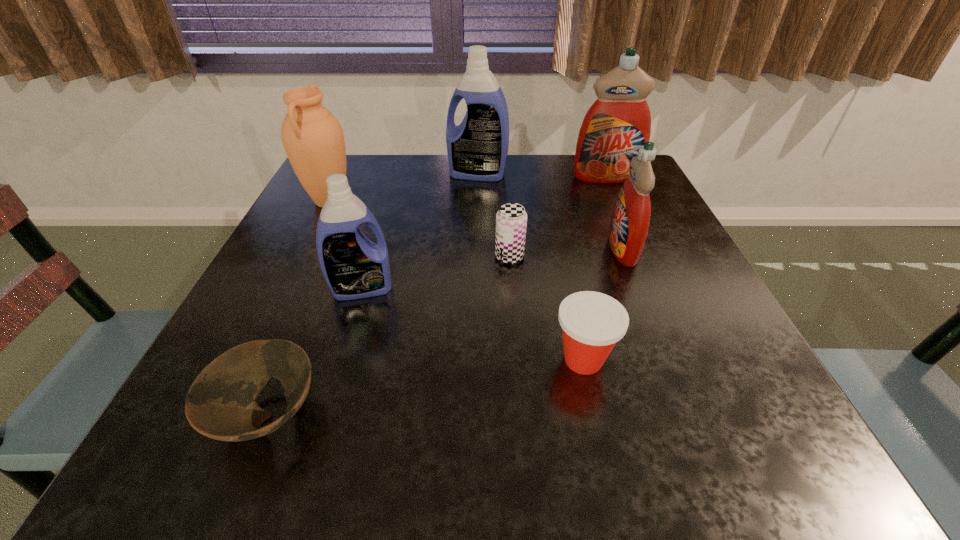
This screenshot has width=960, height=540. I want to click on free spot between the bowl and the bigger red detergent, so click(437, 296).

Locate an element on the screen. The height and width of the screenshot is (540, 960). blank region between the brown bowl and the Dixie cup is located at coordinates click(425, 388).

The height and width of the screenshot is (540, 960). I want to click on vacant region between the sixth object from left to right and the farther red detergent, so click(x=594, y=268).

I want to click on vacant area that lies between the nearer red detergent and the left blue detergent, so click(x=492, y=269).

Locate an element on the screen. The image size is (960, 540). empty space between the sixth nearest object and the farther red detergent is located at coordinates (468, 190).

The width and height of the screenshot is (960, 540). Find the location of `free space between the urn and the farther blue detergent`. free space between the urn and the farther blue detergent is located at coordinates 403,188.

Locate an element on the screen. empty space between the third detergent from right to left and the second nearest detergent is located at coordinates (550, 212).

You are a GUI agent. You are given a task and a screenshot of the screen. Output one action in this format:
    pyautogui.click(x=<x>, y=<y>)
    Task: Click on the object that is the sixth closest one to the third nearest object
    
    Given the screenshot: What is the action you would take?
    pyautogui.click(x=630, y=220)

Locate which object is the fourth closest to the red-orange Dixie cup. Please provide its 2D coordinates. Your answer should be formatted as a tuple, i.e. [(x, y)], where the tuple contains the x and y coordinates of a point satisfying the conditions above.

[(221, 404)]

This screenshot has width=960, height=540. Identify the location of detergent that is the second closest to the purple beer can. (354, 267).